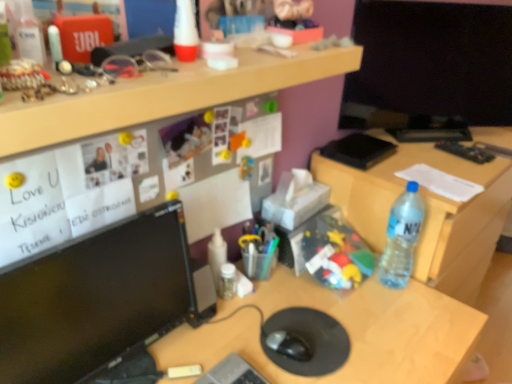
Identify the location of empty space that is ontop of matte black monitor at center, acting as the 1th desk starting from the bottom (from a real-world perspective). (269, 328).